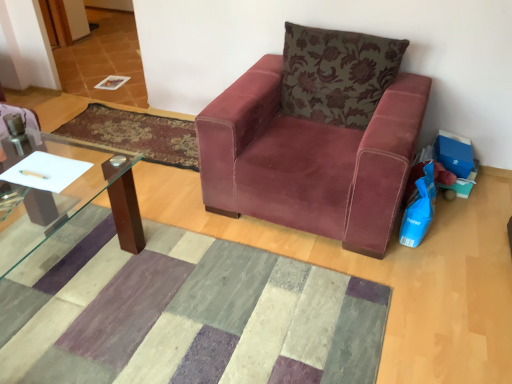
Where is `spots to the right of metallic silver pen at lower left`? The width and height of the screenshot is (512, 384). spots to the right of metallic silver pen at lower left is located at coordinates (56, 174).